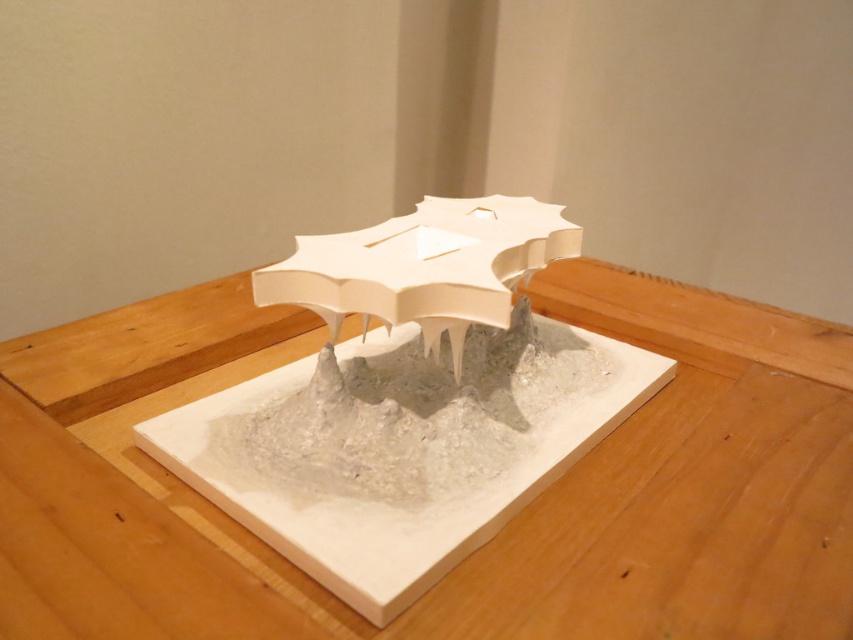
Consider the image. You are a delivery drone with a 12 inch wingspan. You need to fly between the white matte table at center and the matte white umbrella at center. Can you fit through the space between them?

The distance between the white matte table at center and the matte white umbrella at center is 12.59 inches. Since your wingspan is 12 inches, you can fit through the space between them as there is enough clearance.

You are setting up a small decorative item on the white matte table at center. The item requires a space wider than the matte white umbrella at center. Will the table provide enough width for this item?

The white matte table at center has a greater width than the matte white umbrella at center, so it can accommodate the decorative item requiring more space than the umbrella.

You are a visitor at an exhibition and see the white matte table at center and the matte white umbrella at center. Which object is closer to you?

The white matte table at center is closer to you because it is in front of the matte white umbrella at center.